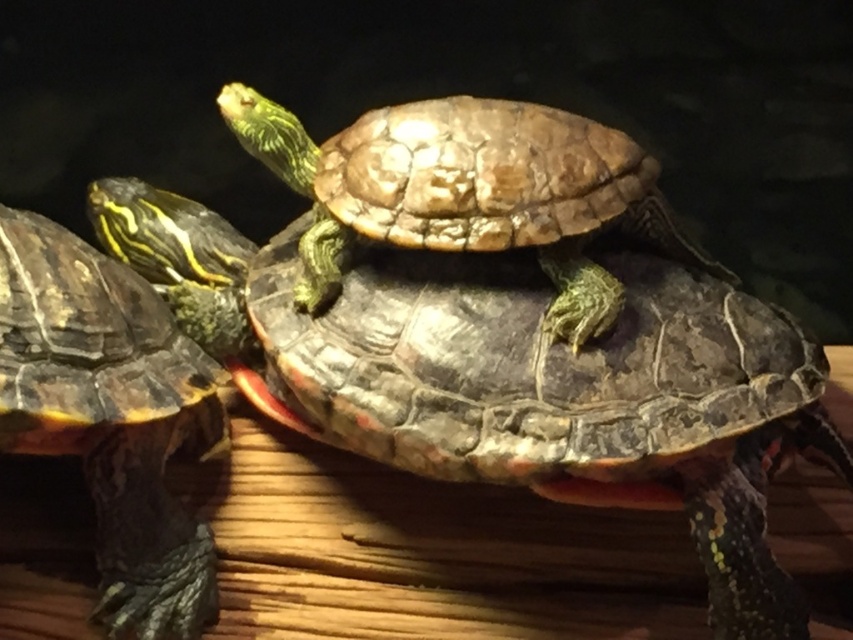
Can you confirm if shiny brown tortoise at center is smaller than shiny black tortoise at left?

Yes, shiny brown tortoise at center is smaller than shiny black tortoise at left.

Who is more distant from viewer, (595, 184) or (180, 618)?

The point (595, 184) is more distant.

Identify the location of shiny brown tortoise at center. (468, 193).

Is shiny brown tortoise at center to the right of shiny green tortoise at center from the viewer's perspective?

Indeed, shiny brown tortoise at center is positioned on the right side of shiny green tortoise at center.

This screenshot has height=640, width=853. I want to click on shiny brown tortoise at center, so click(468, 193).

Who is taller, shiny dark green tortoise at center or shiny green tortoise at center?

shiny dark green tortoise at center

Who is more distant from viewer, (254, 314) or (195, 310)?

Positioned behind is point (195, 310).

Measure the distance between point (424,259) and camera.

Point (424,259) is 4.75 feet from camera.

This screenshot has width=853, height=640. In order to click on shiny dark green tortoise at center in this screenshot , I will do `click(511, 376)`.